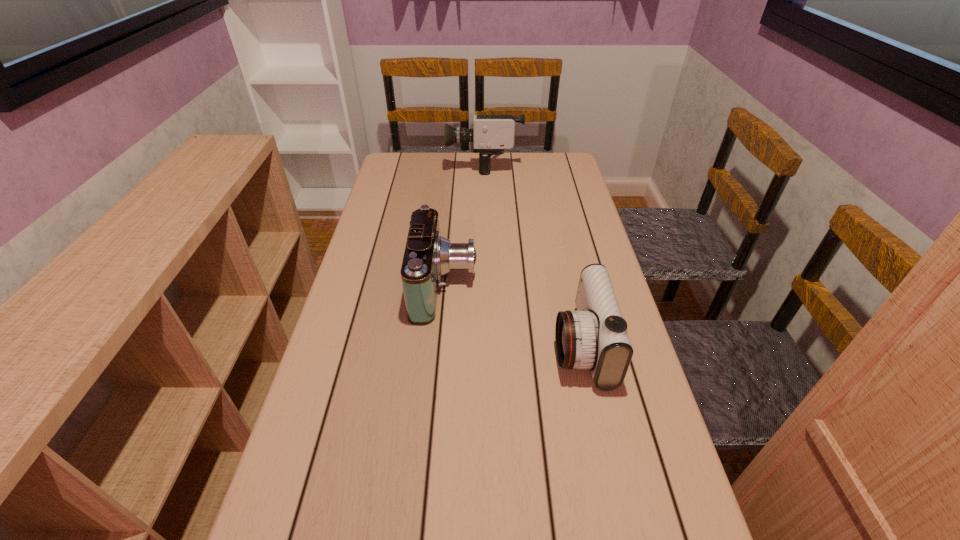
Choose which object is the nearest neighbor to the tallest camcorder. Please provide its 2D coordinates. Your answer should be formatted as a tuple, i.e. [(x, y)], where the tuple contains the x and y coordinates of a point satisfying the conditions above.

[(428, 255)]

The image size is (960, 540). I want to click on the closest camcorder to the farthest object, so click(428, 255).

Where is `the closest camcorder relative to the farthest object`? the closest camcorder relative to the farthest object is located at coordinates (428, 255).